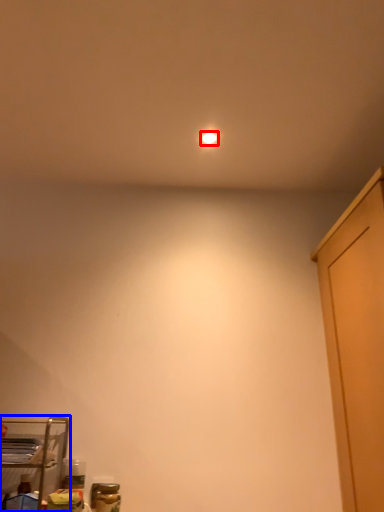
Question: Which object appears farthest to the camera in this image, lighting (highlighted by a red box) or furniture (highlighted by a blue box)?

Choices:
 (A) lighting
 (B) furniture

Answer: (A)